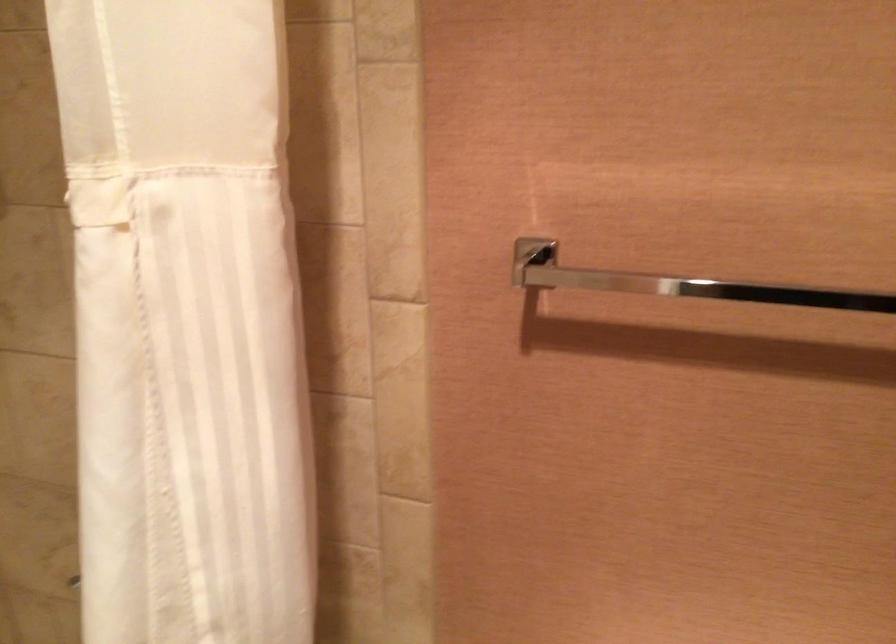
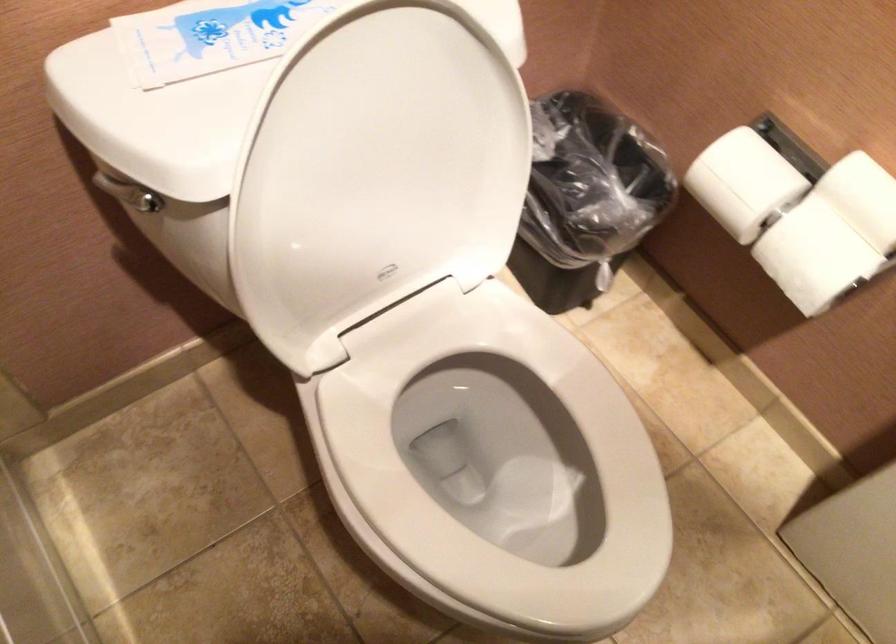
First-person continuous shooting, in which direction is the camera rotating?

The camera's rotation is toward right-down.